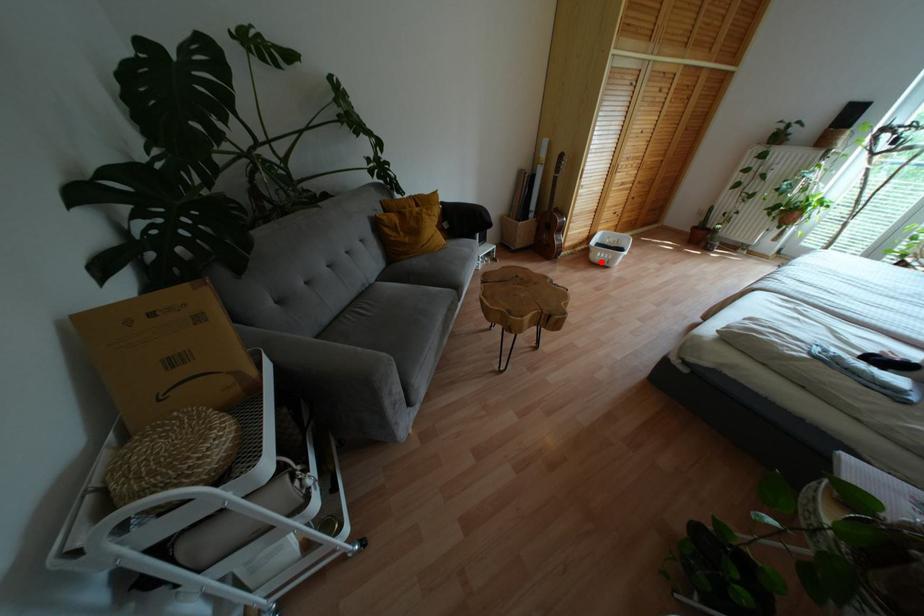
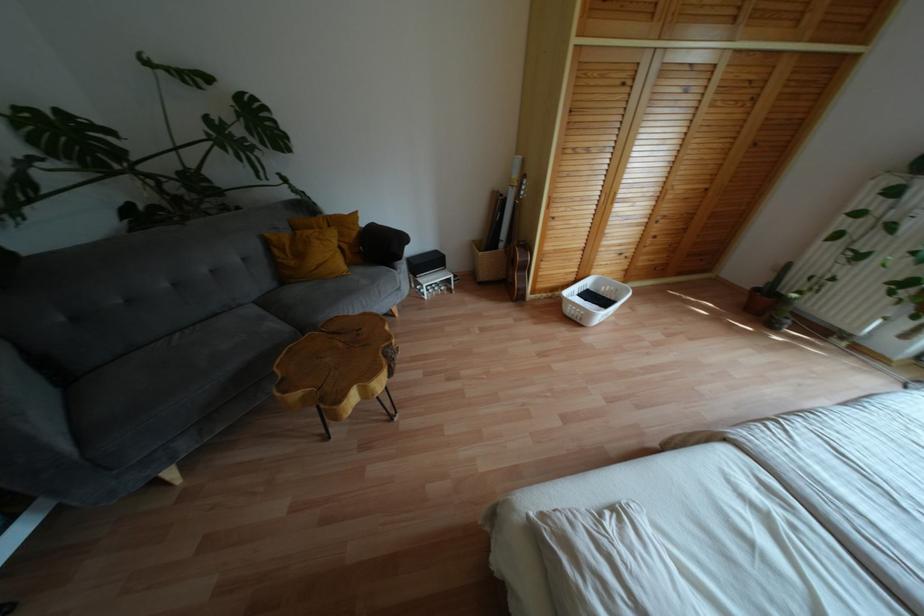
Where in the second image is the point corresponding to the highlighted location from the first image?

(573, 318)